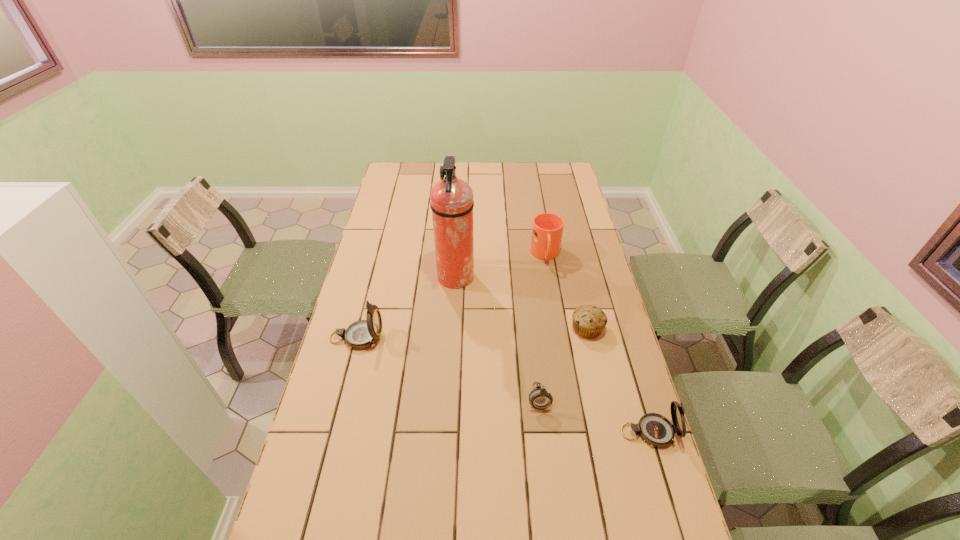
The width and height of the screenshot is (960, 540). What are the coordinates of `vacant area situated 0.170m on the face of the farthest compass` in the screenshot? It's located at (436, 338).

This screenshot has width=960, height=540. Find the location of `vacant region located on the face of the second nearest compass`. vacant region located on the face of the second nearest compass is located at coordinates (549, 489).

Locate an element on the screen. The image size is (960, 540). free point located on the handle side of the mug is located at coordinates (x=557, y=321).

You are a GUI agent. You are given a task and a screenshot of the screen. Output one action in this format:
    pyautogui.click(x=<x>, y=<y>)
    Task: Click on the vacant region located at the nozzle of the fifth object from right to left
    The height and width of the screenshot is (540, 960).
    Given the screenshot: What is the action you would take?
    pyautogui.click(x=528, y=278)

Find the location of a particular element. free region located on the back of the muffin is located at coordinates (580, 295).

The height and width of the screenshot is (540, 960). I want to click on object located in the left edge section of the desktop, so click(x=362, y=334).

Identify the location of compass positioned at the right edge. (656, 430).

Identify the location of mug present at the right edge. Image resolution: width=960 pixels, height=540 pixels. (547, 230).

The image size is (960, 540). I want to click on muffin situated at the right edge, so click(589, 321).

Find the location of a particular element. This screenshot has height=540, width=960. free location at the far edge is located at coordinates [x=523, y=179].